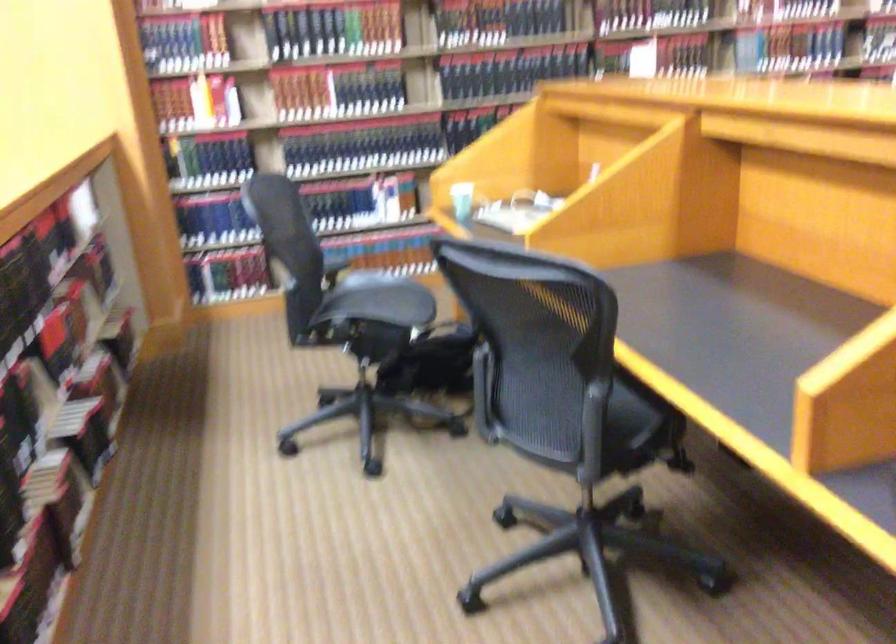
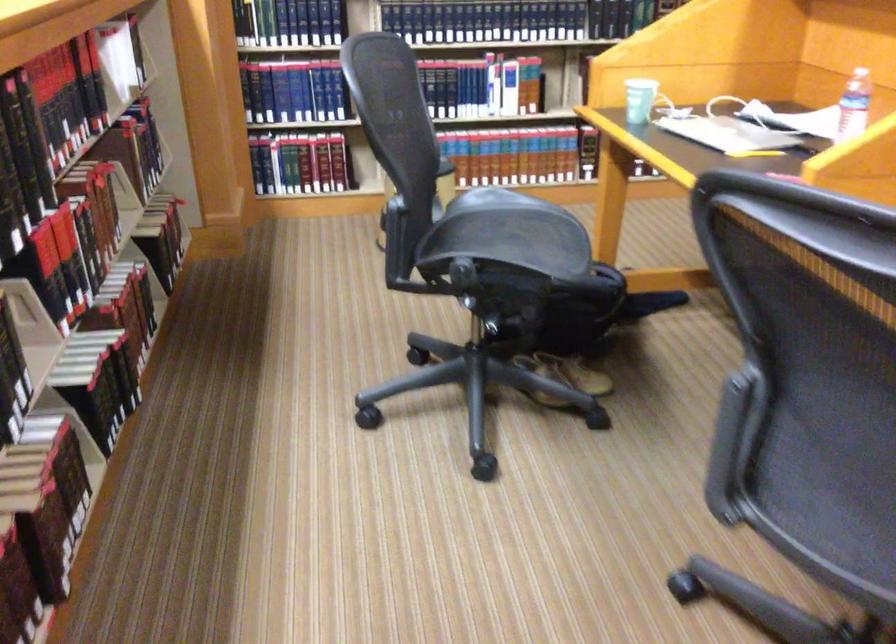
Find the pixel in the second image that matches (x=432, y=406) in the first image.

(564, 377)